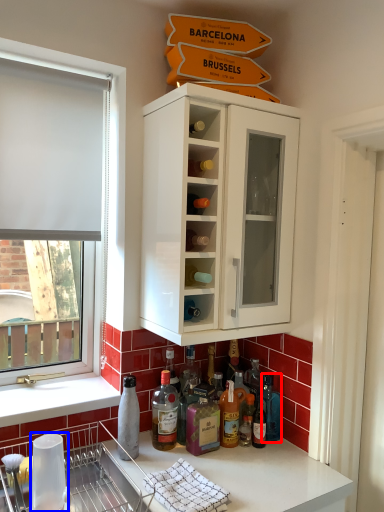
Question: Which of the following is the closest to the observer, bottle (highlighted by a red box) or appliance (highlighted by a blue box)?

Choices:
 (A) bottle
 (B) appliance

Answer: (B)